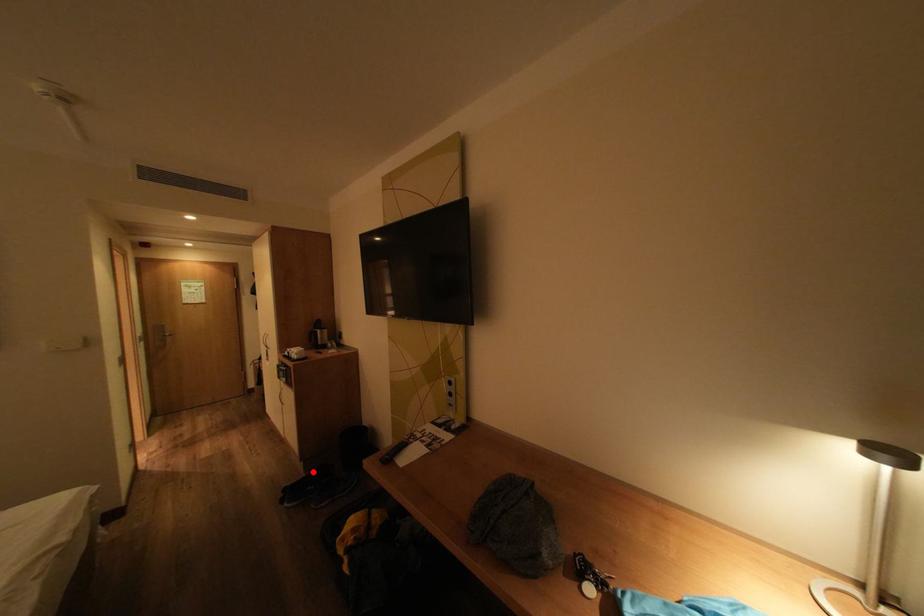
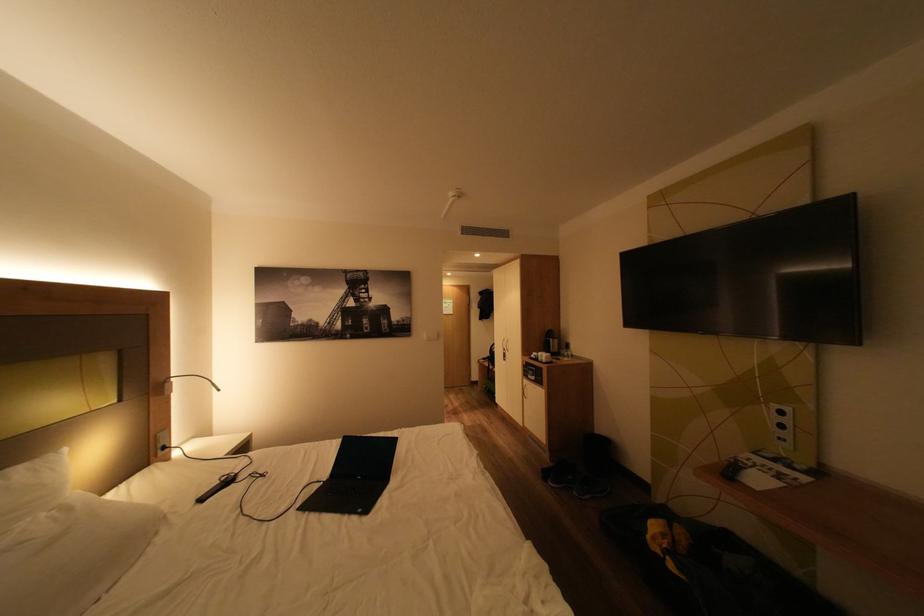
Question: I am providing you with two images of the same scene from different viewpoints. A red point is marked on the first image. Is the red point's position out of view in image 2?

Choices:
 (A) Yes
 (B) No

Answer: (B)